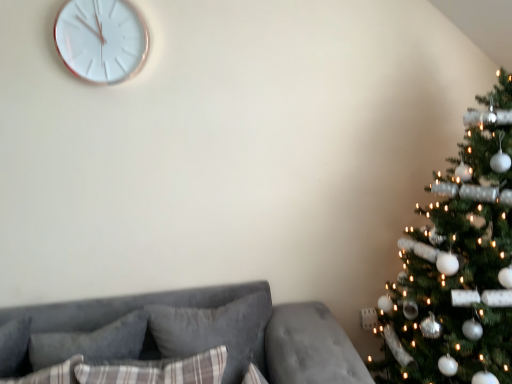
I want to click on velvet gray couch at lower left, so click(x=309, y=347).

Measure the distance between point (x=59, y=51) and camera.

5.37 feet.

Where is `plush gray pillow at lower left, acting as the second pillow starting from the front`? The width and height of the screenshot is (512, 384). plush gray pillow at lower left, acting as the second pillow starting from the front is located at coordinates (91, 342).

In order to face plush gray pillow at lower left, which appears as the second pillow when viewed from the back, should I rotate leftwards or rightwards?

Turn left approximately 21.849 degrees to face it.

Describe the element at coordinates (215, 332) in the screenshot. I see `plush gray pillow at center, placed as the third pillow when sorted from front to back` at that location.

Locate an element on the screen. Image resolution: width=512 pixels, height=384 pixels. velvet gray couch at lower left is located at coordinates (309, 347).

Is plush gray pillow at lower left, acting as the second pillow starting from the front, oriented away from plaid fabric pillow at center, which is the first pillow in front-to-back order?

plush gray pillow at lower left, acting as the second pillow starting from the front, is not turned away from plaid fabric pillow at center, which is the first pillow in front-to-back order.

Does plush gray pillow at lower left, which appears as the second pillow when viewed from the back, appear on the right side of plaid fabric pillow at center, which ranks as the 3th pillow in back-to-front order?

In fact, plush gray pillow at lower left, which appears as the second pillow when viewed from the back, is to the left of plaid fabric pillow at center, which ranks as the 3th pillow in back-to-front order.

Based on the photo, from the image's perspective, which object appears higher, plush gray pillow at lower left, which appears as the second pillow when viewed from the back, or plaid fabric pillow at center, which is the first pillow in front-to-back order?

From the image's view, plush gray pillow at lower left, which appears as the second pillow when viewed from the back, is above.

Which object is further away from the camera taking this photo, plush gray pillow at lower left, which appears as the second pillow when viewed from the back, or plaid fabric pillow at center, which is the first pillow in front-to-back order?

plush gray pillow at lower left, which appears as the second pillow when viewed from the back, is behind.

Is plush gray pillow at center, placed as the first pillow when sorted from back to front, thinner than green textured christmas tree at right?

Correct, the width of plush gray pillow at center, placed as the first pillow when sorted from back to front, is less than that of green textured christmas tree at right.

From the image's perspective, is plush gray pillow at center, placed as the first pillow when sorted from back to front, on green textured christmas tree at right?

Incorrect, from the image's perspective, plush gray pillow at center, placed as the first pillow when sorted from back to front, is lower than green textured christmas tree at right.

Starting from the green textured christmas tree at right, which pillow is the 1st one to the left? Please provide its 2D coordinates.

[(215, 332)]

In the image, is plush gray pillow at center, placed as the third pillow when sorted from front to back, on the left side or the right side of green textured christmas tree at right?

Based on their positions, plush gray pillow at center, placed as the third pillow when sorted from front to back, is located to the left of green textured christmas tree at right.

From the image's perspective, who appears lower, white glossy clock at upper left or plaid fabric pillow at center, which ranks as the 3th pillow in back-to-front order?

plaid fabric pillow at center, which ranks as the 3th pillow in back-to-front order, appears lower in the image.

In terms of size, does white glossy clock at upper left appear bigger or smaller than plaid fabric pillow at center, which ranks as the 3th pillow in back-to-front order?

In the image, white glossy clock at upper left appears to be smaller than plaid fabric pillow at center, which ranks as the 3th pillow in back-to-front order.

Is white glossy clock at upper left facing away from plaid fabric pillow at center, which is the first pillow in front-to-back order?

No, white glossy clock at upper left is not facing the opposite direction of plaid fabric pillow at center, which is the first pillow in front-to-back order.

Is plaid fabric pillow at center, which is the first pillow in front-to-back order, touching plush gray pillow at center, placed as the third pillow when sorted from front to back?

There is a gap between plaid fabric pillow at center, which is the first pillow in front-to-back order, and plush gray pillow at center, placed as the third pillow when sorted from front to back.

Is plush gray pillow at center, placed as the first pillow when sorted from back to front, at the back of plaid fabric pillow at center, which is the first pillow in front-to-back order?

Yes, plaid fabric pillow at center, which is the first pillow in front-to-back order, is positioned with its back facing plush gray pillow at center, placed as the first pillow when sorted from back to front.

Find the location of a particular element. The height and width of the screenshot is (384, 512). pillow that is the 1st one when counting upward from the plaid fabric pillow at center, which is the first pillow in front-to-back order (from the image's perspective) is located at coordinates (215, 332).

Is plush gray pillow at center, placed as the first pillow when sorted from back to front, completely or partially inside plaid fabric pillow at center, which is the first pillow in front-to-back order?

No, plush gray pillow at center, placed as the first pillow when sorted from back to front, is not inside plaid fabric pillow at center, which is the first pillow in front-to-back order.

In the scene shown: Considering the positions of objects green textured christmas tree at right and velvet gray couch at lower left in the image provided, who is behind, green textured christmas tree at right or velvet gray couch at lower left?

velvet gray couch at lower left is further from the camera.

Looking at the image, does green textured christmas tree at right seem bigger or smaller compared to velvet gray couch at lower left?

In the image, green textured christmas tree at right appears to be larger than velvet gray couch at lower left.

From the image's perspective, would you say green textured christmas tree at right is shown under velvet gray couch at lower left?

No.

Considering the points (408, 378) and (295, 368), which point is behind, point (408, 378) or point (295, 368)?

Point (408, 378)

Which is nearer, (35, 322) or (196, 321)?

Point (35, 322).

Which of these two, velvet gray couch at lower left or plush gray pillow at center, placed as the third pillow when sorted from front to back, stands shorter?

Standing shorter between the two is plush gray pillow at center, placed as the third pillow when sorted from front to back.

Do you think velvet gray couch at lower left is within plush gray pillow at center, placed as the third pillow when sorted from front to back, or outside of it?

velvet gray couch at lower left is spatially situated outside plush gray pillow at center, placed as the third pillow when sorted from front to back.

Between velvet gray couch at lower left and plush gray pillow at center, placed as the third pillow when sorted from front to back, which one is positioned in front?

velvet gray couch at lower left is in front.

How distant is green textured christmas tree at right from plaid fabric pillow at center, which ranks as the 3th pillow in back-to-front order?

green textured christmas tree at right is 89.27 centimeters away from plaid fabric pillow at center, which ranks as the 3th pillow in back-to-front order.

Considering the positions of objects green textured christmas tree at right and plaid fabric pillow at center, which is the first pillow in front-to-back order, in the image provided, who is more to the right, green textured christmas tree at right or plaid fabric pillow at center, which is the first pillow in front-to-back order,?

green textured christmas tree at right is more to the right.

Is green textured christmas tree at right looking in the opposite direction of plaid fabric pillow at center, which ranks as the 3th pillow in back-to-front order?

No, green textured christmas tree at right is not facing away from plaid fabric pillow at center, which ranks as the 3th pillow in back-to-front order.

Is green textured christmas tree at right positioned far away from plaid fabric pillow at center, which is the first pillow in front-to-back order?

green textured christmas tree at right is actually quite close to plaid fabric pillow at center, which is the first pillow in front-to-back order.

Which pillow is the 1st one when counting from the right side of the plush gray pillow at lower left, which appears as the second pillow when viewed from the back? Please provide its 2D coordinates.

[(159, 371)]

This screenshot has height=384, width=512. There is a green textured christmas tree at right. Identify the location of the 2nd pillow below it (from the image's perspective). (215, 332).

Based on their spatial positions, is green textured christmas tree at right or white glossy clock at upper left closer to plush gray pillow at center, placed as the first pillow when sorted from back to front?

The object closer to plush gray pillow at center, placed as the first pillow when sorted from back to front, is green textured christmas tree at right.

Estimate the real-world distances between objects in this image. Which object is further from plush gray pillow at center, placed as the first pillow when sorted from back to front, plaid fabric pillow at center, which is the first pillow in front-to-back order, or velvet gray couch at lower left?

plaid fabric pillow at center, which is the first pillow in front-to-back order, is further to plush gray pillow at center, placed as the first pillow when sorted from back to front.

Estimate the real-world distances between objects in this image. Which object is closer to plush gray pillow at lower left, acting as the second pillow starting from the front, velvet gray couch at lower left or green textured christmas tree at right?

The object closer to plush gray pillow at lower left, acting as the second pillow starting from the front, is velvet gray couch at lower left.

Estimate the real-world distances between objects in this image. Which object is further from plaid fabric pillow at center, which ranks as the 3th pillow in back-to-front order, plush gray pillow at center, placed as the third pillow when sorted from front to back, or velvet gray couch at lower left?

Based on the image, velvet gray couch at lower left appears to be further to plaid fabric pillow at center, which ranks as the 3th pillow in back-to-front order.

Which object lies further to the anchor point plush gray pillow at center, placed as the third pillow when sorted from front to back, plaid fabric pillow at center, which ranks as the 3th pillow in back-to-front order, or plush gray pillow at lower left, acting as the second pillow starting from the front?

Based on the image, plush gray pillow at lower left, acting as the second pillow starting from the front, appears to be further to plush gray pillow at center, placed as the third pillow when sorted from front to back.

Considering their positions, is velvet gray couch at lower left positioned further to plaid fabric pillow at center, which is the first pillow in front-to-back order, than plush gray pillow at center, placed as the first pillow when sorted from back to front?

velvet gray couch at lower left lies further to plaid fabric pillow at center, which is the first pillow in front-to-back order, than the other object.

From the image, which object appears to be nearer to green textured christmas tree at right, plaid fabric pillow at center, which ranks as the 3th pillow in back-to-front order, or velvet gray couch at lower left?

Based on the image, velvet gray couch at lower left appears to be nearer to green textured christmas tree at right.

Considering their positions, is plaid fabric pillow at center, which ranks as the 3th pillow in back-to-front order, positioned closer to plush gray pillow at lower left, which appears as the second pillow when viewed from the back, than plush gray pillow at center, placed as the third pillow when sorted from front to back?

Among the two, plush gray pillow at center, placed as the third pillow when sorted from front to back, is located nearer to plush gray pillow at lower left, which appears as the second pillow when viewed from the back.

Where is `pillow located between plush gray pillow at lower left, which appears as the second pillow when viewed from the back, and plush gray pillow at center, placed as the first pillow when sorted from back to front, in the left-right direction`? The width and height of the screenshot is (512, 384). pillow located between plush gray pillow at lower left, which appears as the second pillow when viewed from the back, and plush gray pillow at center, placed as the first pillow when sorted from back to front, in the left-right direction is located at coordinates (159, 371).

Find the location of a particular element. wall clock located between plush gray pillow at lower left, which appears as the second pillow when viewed from the back, and green textured christmas tree at right in the left-right direction is located at coordinates [101, 39].

The width and height of the screenshot is (512, 384). I want to click on studio couch between plush gray pillow at lower left, acting as the second pillow starting from the front, and plaid fabric pillow at center, which ranks as the 3th pillow in back-to-front order, so click(309, 347).

This screenshot has width=512, height=384. Identify the location of pillow between plaid fabric pillow at center, which ranks as the 3th pillow in back-to-front order, and green textured christmas tree at right from left to right. (215, 332).